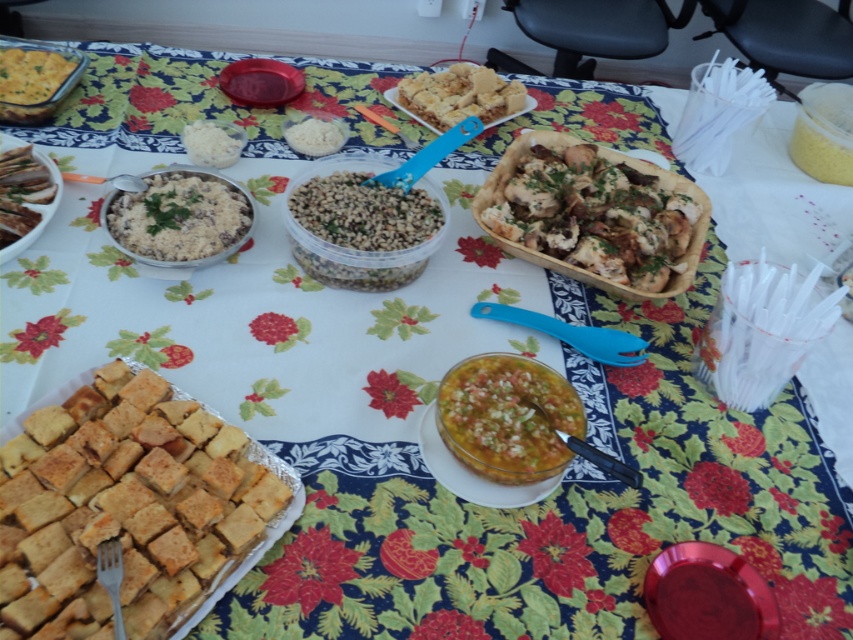
Consider the image. Is golden brown crumbly bread at lower left smaller than white rice at center?

Incorrect, golden brown crumbly bread at lower left is not smaller in size than white rice at center.

Who is more forward, [149,380] or [222,204]?

Positioned in front is point [149,380].

Who is more distant from viewer, (76,556) or (192,186)?

The point (192,186) is behind.

Identify the location of golden brown crumbly bread at lower left. (131, 502).

Can you confirm if brown matte rice at center is shorter than golden brown crumbly bread at center?

Incorrect, brown matte rice at center's height does not fall short of golden brown crumbly bread at center's.

Is point (335, 216) farther from viewer compared to point (473, 97)?

No.

Between point (378, 172) and point (436, 113), which one is positioned behind?

Point (436, 113)

I want to click on brown matte rice at center, so click(363, 224).

Which is behind, point (148, 182) or point (32, 184)?

Point (148, 182)

Is white rice at center thinner than brown matte meat at upper left?

Incorrect, white rice at center's width is not less than brown matte meat at upper left's.

This screenshot has height=640, width=853. What do you see at coordinates (178, 216) in the screenshot? I see `white rice at center` at bounding box center [178, 216].

This screenshot has height=640, width=853. I want to click on white rice at center, so click(x=178, y=216).